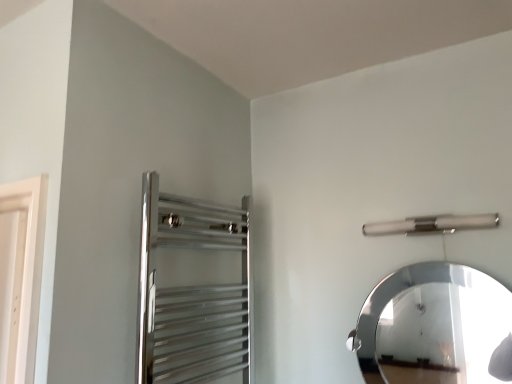
This screenshot has width=512, height=384. What do you see at coordinates (442, 334) in the screenshot?
I see `polished silver mirror at upper right` at bounding box center [442, 334].

Find the location of a particular element. This screenshot has height=384, width=512. satin nickel towel bar at upper right is located at coordinates (431, 224).

Where is `polished chrome towel rack at upper left`? polished chrome towel rack at upper left is located at coordinates (192, 290).

Can you confirm if polished silver mirror at upper right is shorter than polished chrome towel rack at upper left?

Yes, polished silver mirror at upper right is shorter than polished chrome towel rack at upper left.

Which object is closer to the camera taking this photo, polished silver mirror at upper right or polished chrome towel rack at upper left?

polished chrome towel rack at upper left is closer to the camera.

How distant is polished silver mirror at upper right from polished chrome towel rack at upper left?

polished silver mirror at upper right is 5.57 feet from polished chrome towel rack at upper left.

Can you confirm if polished chrome towel rack at upper left is shorter than satin nickel towel bar at upper right?

No.

Locate an element on the screen. screen door in front of the satin nickel towel bar at upper right is located at coordinates (192, 290).

From the image's perspective, is polished chrome towel rack at upper left located beneath satin nickel towel bar at upper right?

Yes, from the image's perspective, polished chrome towel rack at upper left is beneath satin nickel towel bar at upper right.

Can you tell me how much polished silver mirror at upper right and satin nickel towel bar at upper right differ in facing direction?

The facing directions of polished silver mirror at upper right and satin nickel towel bar at upper right are 0.662 degrees apart.

From a real-world perspective, which object rests below the other?

polished silver mirror at upper right, from a real-world perspective.

Is polished silver mirror at upper right at the left side of satin nickel towel bar at upper right?

Yes.

Between polished silver mirror at upper right and satin nickel towel bar at upper right, which one is positioned in front?

Positioned in front is polished silver mirror at upper right.

The width and height of the screenshot is (512, 384). Identify the location of screen door lying in front of the polished silver mirror at upper right. (192, 290).

Is polished chrome towel rack at upper left looking in the opposite direction of polished silver mirror at upper right?

No, polished chrome towel rack at upper left is not facing the opposite direction of polished silver mirror at upper right.

Is polished chrome towel rack at upper left shorter than polished silver mirror at upper right?

Incorrect, the height of polished chrome towel rack at upper left does not fall short of that of polished silver mirror at upper right.

From the image's perspective, is polished chrome towel rack at upper left located above or below polished silver mirror at upper right?

Clearly, from the image's perspective, polished chrome towel rack at upper left is above polished silver mirror at upper right.

From the picture: Between satin nickel towel bar at upper right and polished silver mirror at upper right, which one has more height?

polished silver mirror at upper right.

Who is more distant, satin nickel towel bar at upper right or polished silver mirror at upper right?

satin nickel towel bar at upper right is behind.

In the scene shown: Is satin nickel towel bar at upper right not close to polished silver mirror at upper right?

Yes, satin nickel towel bar at upper right is far from polished silver mirror at upper right.

The height and width of the screenshot is (384, 512). In order to click on mirror that is in front of the satin nickel towel bar at upper right in this screenshot , I will do `click(442, 334)`.

Does satin nickel towel bar at upper right appear on the left side of polished chrome towel rack at upper left?

No, satin nickel towel bar at upper right is not to the left of polished chrome towel rack at upper left.

Considering the sizes of objects satin nickel towel bar at upper right and polished chrome towel rack at upper left in the image provided, who is bigger, satin nickel towel bar at upper right or polished chrome towel rack at upper left?

polished chrome towel rack at upper left is bigger.

How far apart are satin nickel towel bar at upper right and polished chrome towel rack at upper left?

satin nickel towel bar at upper right is 25.20 inches away from polished chrome towel rack at upper left.

Is satin nickel towel bar at upper right oriented towards polished chrome towel rack at upper left?

No, satin nickel towel bar at upper right is not facing towards polished chrome towel rack at upper left.

Find the location of a particular element. The image size is (512, 384). screen door to the left of polished silver mirror at upper right is located at coordinates (192, 290).

Where is `towel bar on the right of polished chrome towel rack at upper left`? Image resolution: width=512 pixels, height=384 pixels. towel bar on the right of polished chrome towel rack at upper left is located at coordinates (431, 224).

Looking at the image, which one is located further to satin nickel towel bar at upper right, polished chrome towel rack at upper left or polished silver mirror at upper right?

The object further to satin nickel towel bar at upper right is polished silver mirror at upper right.

Which object lies nearer to the anchor point polished silver mirror at upper right, polished chrome towel rack at upper left or satin nickel towel bar at upper right?

satin nickel towel bar at upper right.

Considering their positions, is satin nickel towel bar at upper right positioned closer to polished chrome towel rack at upper left than polished silver mirror at upper right?

satin nickel towel bar at upper right is positioned closer to the anchor polished chrome towel rack at upper left.

In the scene shown: From the image, which object appears to be farther from polished silver mirror at upper right, satin nickel towel bar at upper right or polished chrome towel rack at upper left?

polished chrome towel rack at upper left.

From the image, which object appears to be nearer to satin nickel towel bar at upper right, polished silver mirror at upper right or polished chrome towel rack at upper left?

Among the two, polished chrome towel rack at upper left is located nearer to satin nickel towel bar at upper right.

When comparing their distances from polished chrome towel rack at upper left, does polished silver mirror at upper right or satin nickel towel bar at upper right seem closer?

The object closer to polished chrome towel rack at upper left is satin nickel towel bar at upper right.

Where is `mirror between polished chrome towel rack at upper left and satin nickel towel bar at upper right in the horizontal direction`? mirror between polished chrome towel rack at upper left and satin nickel towel bar at upper right in the horizontal direction is located at coordinates (442, 334).